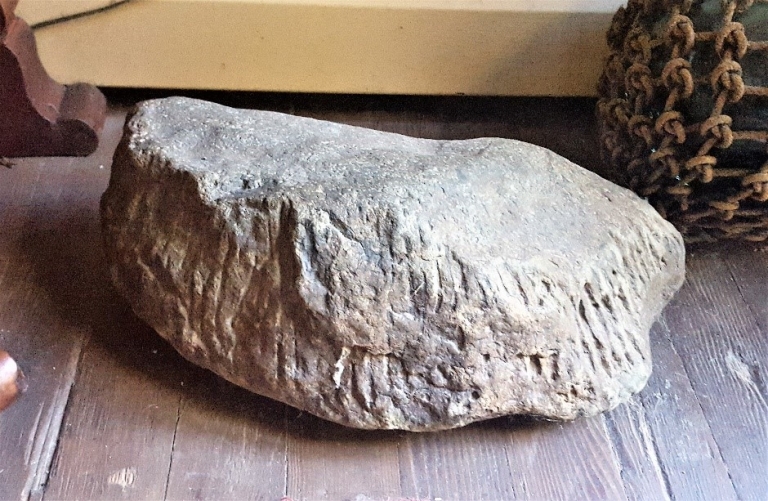
I want to click on floor, so coord(104,475).